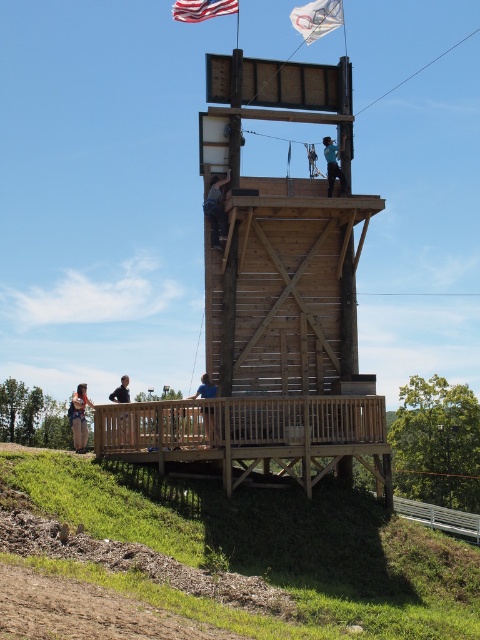
Can you confirm if wooden observation tower at center is positioned to the left of denim jacket at lower left?

No, wooden observation tower at center is not to the left of denim jacket at lower left.

The image size is (480, 640). What do you see at coordinates (288, 284) in the screenshot? I see `wooden observation tower at center` at bounding box center [288, 284].

Identify the location of wooden observation tower at center. (288, 284).

Locate an element on the screen. wooden observation tower at center is located at coordinates (288, 284).

Does blue fabric at upper center appear on the right side of blue shirt at lower center?

Correct, you'll find blue fabric at upper center to the right of blue shirt at lower center.

Does blue fabric at upper center have a smaller size compared to blue shirt at lower center?

Yes.

Who is more forward, [342,148] or [124,385]?

Positioned in front is point [124,385].

The height and width of the screenshot is (640, 480). Find the location of `blue fabric at upper center`. blue fabric at upper center is located at coordinates (334, 164).

Which is in front, point (336, 12) or point (179, 13)?

Positioned in front is point (336, 12).

Between point (305, 35) and point (204, 12), which one is positioned in front?

Point (204, 12)

This screenshot has width=480, height=640. Find the location of `white plastic flag at upper center`. white plastic flag at upper center is located at coordinates pyautogui.click(x=316, y=19).